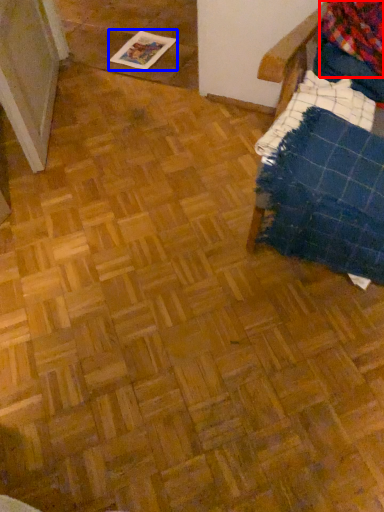
Question: Which object appears farthest to the camera in this image, flannel (highlighted by a red box) or magazine (highlighted by a blue box)?

Choices:
 (A) flannel
 (B) magazine

Answer: (B)